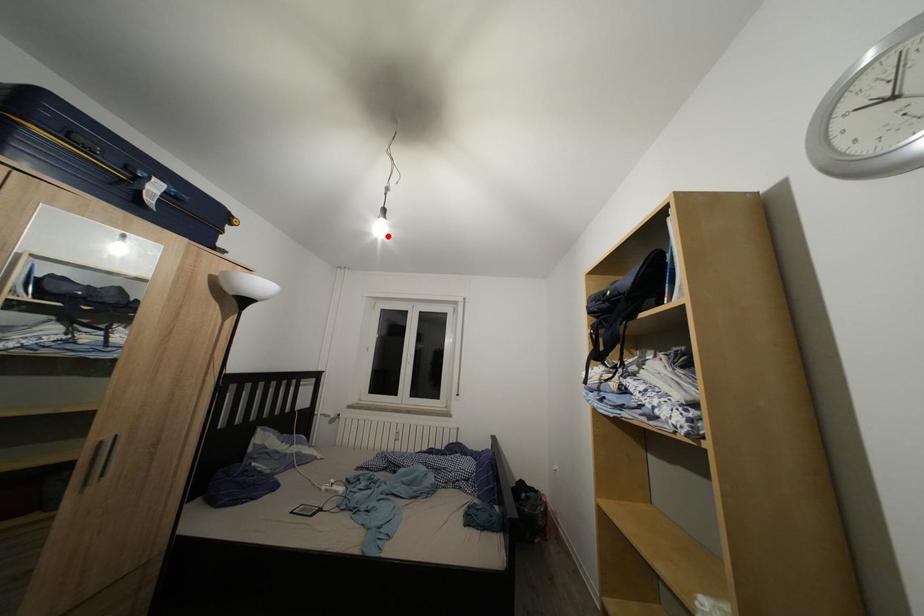
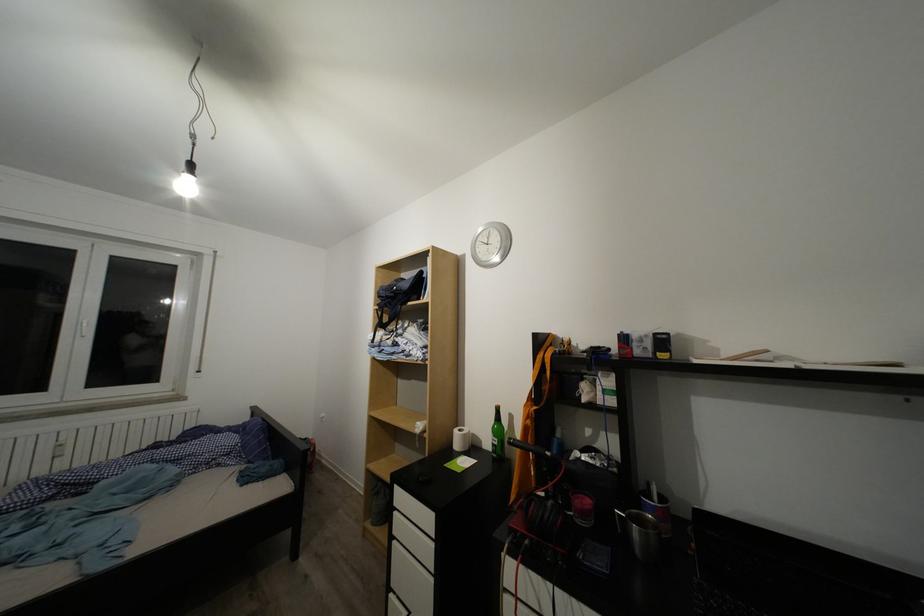
Find the pixel in the second image that matches the highlighted location in the first image.

(193, 195)